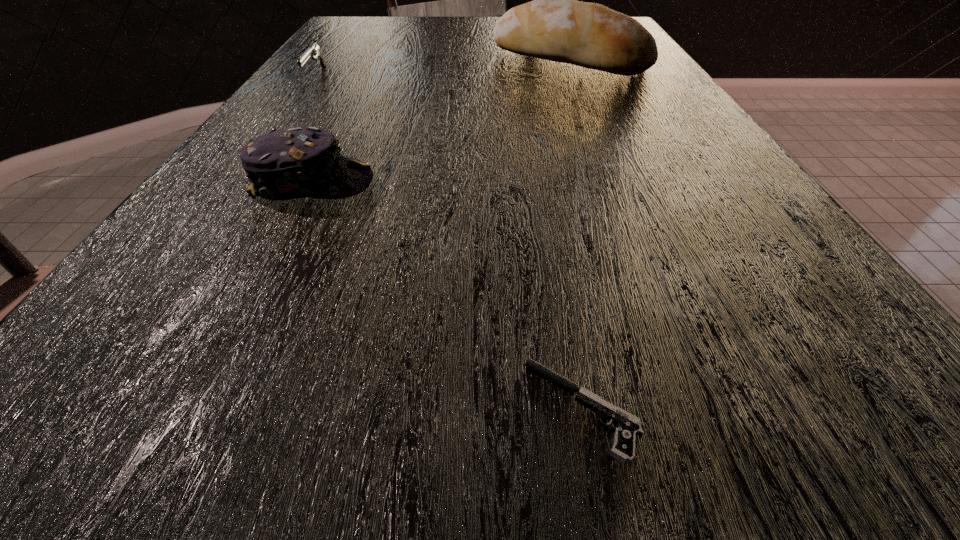
Identify the location of vacant space that satisfies the following two spatial constraints: 1. at the barrel of the farthest object; 2. on the front-facing side of the second shortest pistol. Image resolution: width=960 pixels, height=540 pixels. (526, 77).

Locate an element on the screen. This screenshot has width=960, height=540. free location that satisfies the following two spatial constraints: 1. at the barrel of the tallest pistol; 2. on the back side of the bread is located at coordinates (522, 59).

The image size is (960, 540). In order to click on free space that satisfies the following two spatial constraints: 1. at the barrel of the farthest object; 2. on the back side of the bread in this screenshot , I will do `click(522, 59)`.